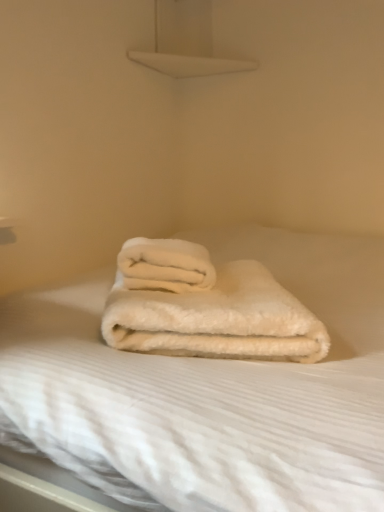
Question: Which direction should I rotate to look at white fluffy towel at center, which is counted as the 1th towel, starting from the top?

Choices:
 (A) right
 (B) left

Answer: (B)

Question: Is white fluffy blanket at center directly adjacent to white fluffy towel at center, which is counted as the 1th towel, starting from the bottom?

Choices:
 (A) no
 (B) yes

Answer: (A)

Question: Are white fluffy blanket at center and white fluffy towel at center, which is counted as the 1th towel, starting from the bottom, located far from each other?

Choices:
 (A) no
 (B) yes

Answer: (A)

Question: From the image's perspective, is white fluffy blanket at center located above white fluffy towel at center, the 2th towel positioned from the top?

Choices:
 (A) yes
 (B) no

Answer: (B)

Question: Considering the relative positions of white fluffy blanket at center and white fluffy towel at center, the 2th towel positioned from the top, in the image provided, is white fluffy blanket at center behind white fluffy towel at center, the 2th towel positioned from the top,?

Choices:
 (A) no
 (B) yes

Answer: (A)

Question: Considering the relative sizes of white fluffy blanket at center and white fluffy towel at center, the 2th towel positioned from the top, in the image provided, is white fluffy blanket at center bigger than white fluffy towel at center, the 2th towel positioned from the top,?

Choices:
 (A) no
 (B) yes

Answer: (B)

Question: Is white fluffy blanket at center to the right of white fluffy towel at center, which is counted as the 1th towel, starting from the bottom, from the viewer's perspective?

Choices:
 (A) yes
 (B) no

Answer: (A)

Question: Is white fluffy towel at center, which is counted as the 1th towel, starting from the top, positioned in front of white fluffy towel at center, the 2th towel positioned from the top?

Choices:
 (A) yes
 (B) no

Answer: (B)

Question: Is white fluffy towel at center, which is counted as the 1th towel, starting from the top, bigger than white fluffy towel at center, which is counted as the 1th towel, starting from the bottom?

Choices:
 (A) no
 (B) yes

Answer: (A)

Question: Can you confirm if white fluffy towel at center, the 2th towel positioned from the bottom, is taller than white fluffy towel at center, which is counted as the 1th towel, starting from the bottom?

Choices:
 (A) yes
 (B) no

Answer: (B)

Question: Can you confirm if white fluffy towel at center, which is counted as the 1th towel, starting from the top, is wider than white fluffy towel at center, the 2th towel positioned from the top?

Choices:
 (A) no
 (B) yes

Answer: (A)

Question: Are white fluffy towel at center, the 2th towel positioned from the bottom, and white fluffy towel at center, the 2th towel positioned from the top, making contact?

Choices:
 (A) no
 (B) yes

Answer: (B)

Question: Is white fluffy towel at center, which is counted as the 1th towel, starting from the top, to the right of white fluffy towel at center, which is counted as the 1th towel, starting from the bottom, from the viewer's perspective?

Choices:
 (A) no
 (B) yes

Answer: (A)

Question: Does white fluffy towel at center, which is counted as the 1th towel, starting from the bottom, have a greater height compared to white fluffy blanket at center?

Choices:
 (A) no
 (B) yes

Answer: (A)